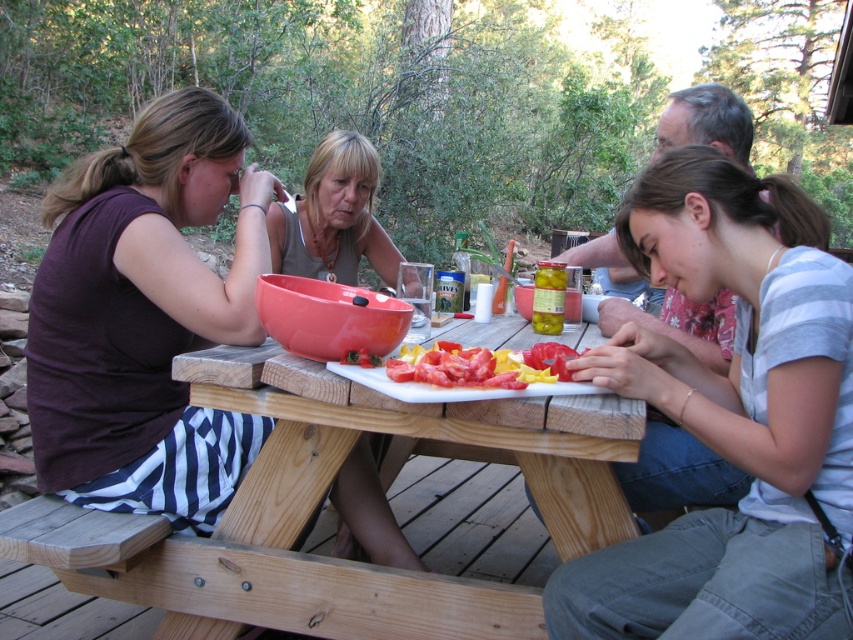
Question: Does light blue cotton shirt at center appear on the right side of sliced red tomato at center?

Choices:
 (A) yes
 (B) no

Answer: (A)

Question: Is light blue cotton shirt at center positioned in front of wooden picnic table at center?

Choices:
 (A) yes
 (B) no

Answer: (A)

Question: Is light blue cotton shirt at center to the right of matte purple shirt at left from the viewer's perspective?

Choices:
 (A) no
 (B) yes

Answer: (B)

Question: Which object appears farthest from the camera in this image?

Choices:
 (A) matte purple shirt at left
 (B) sliced red tomato at center

Answer: (A)

Question: Which of the following is the farthest from the observer?

Choices:
 (A) matte purple shirt at left
 (B) matte pink bowl at center
 (C) sliced red tomato at center

Answer: (B)

Question: Which point is farther from the camera taking this photo?

Choices:
 (A) (320, 484)
 (B) (119, 502)
 (C) (287, 269)

Answer: (C)